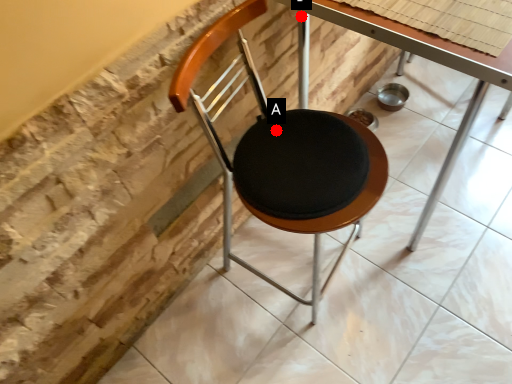
Question: Two points are circled on the image, labeled by A and B beside each circle. Which point is closer to the camera?

Choices:
 (A) A is closer
 (B) B is closer

Answer: (A)